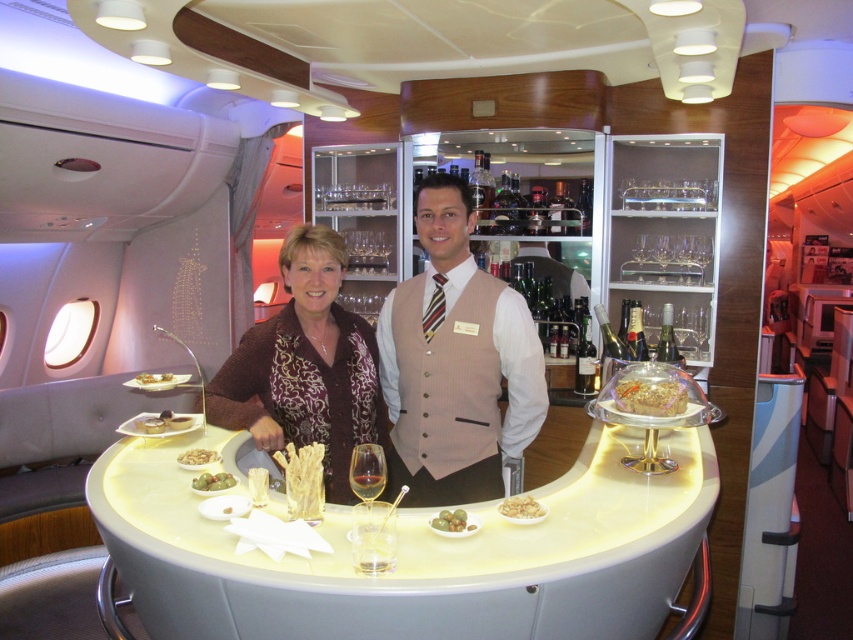
Question: Is matte gold plate at center bigger than translucent glass wine at center?

Choices:
 (A) no
 (B) yes

Answer: (B)

Question: Which object is positioned farthest from the translucent glass wine at center?

Choices:
 (A) matte gold plate at center
 (B) translucent glass wine glass at center

Answer: (A)

Question: Which point is closer to the camera taking this photo?

Choices:
 (A) (372, 461)
 (B) (457, 400)
 (C) (200, 490)

Answer: (A)

Question: Is white glossy table at center to the right of tan fabric vest at center from the viewer's perspective?

Choices:
 (A) yes
 (B) no

Answer: (B)

Question: Which of the following is the farthest from the observer?

Choices:
 (A) brown textured vest at center
 (B) white glossy table at center
 (C) tan fabric vest at center

Answer: (A)

Question: Is green matte olives at center smaller than matte white plate at center?

Choices:
 (A) no
 (B) yes

Answer: (B)